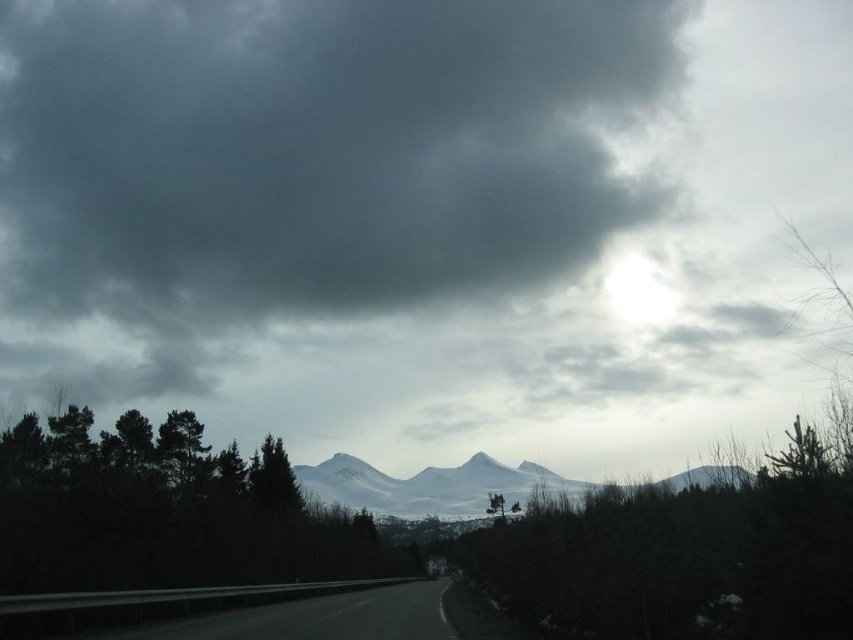
Is dark gray cloud at upper center taller than black asphalt highway at lower center?

Yes.

Is point (33, 208) positioned after point (428, 580)?

Yes, point (33, 208) is farther from viewer.

At what (x,y) coordinates should I click in order to perform the action: click on dark gray cloud at upper center. Please return your answer as a coordinate pair (x, y). Looking at the image, I should click on (300, 170).